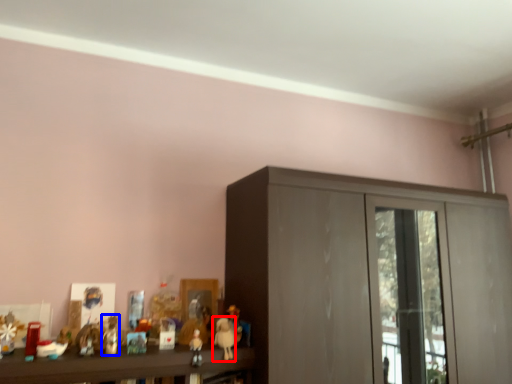
Question: Which of the following is the farthest to the observer, toy (highlighted by a red box) or toy (highlighted by a blue box)?

Choices:
 (A) toy
 (B) toy

Answer: (A)